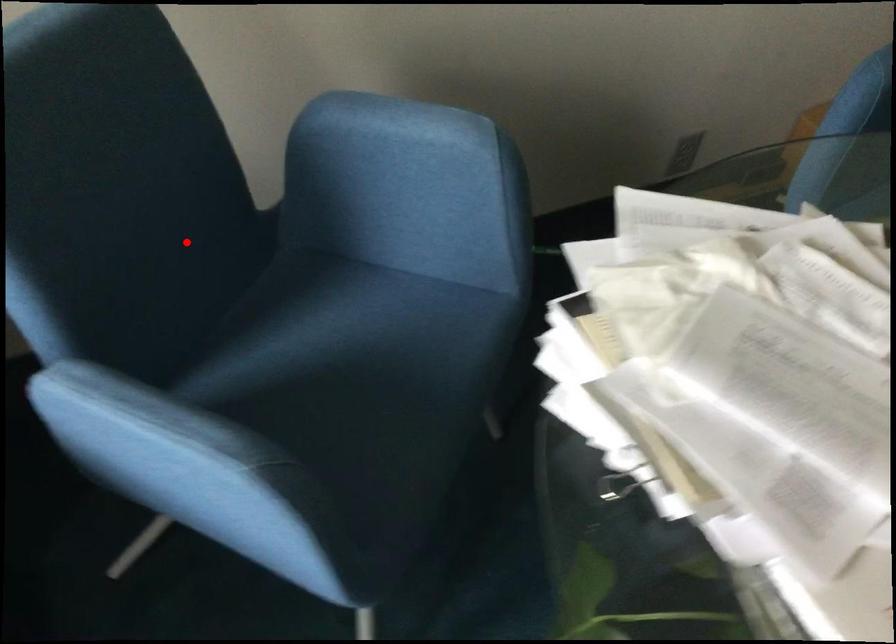
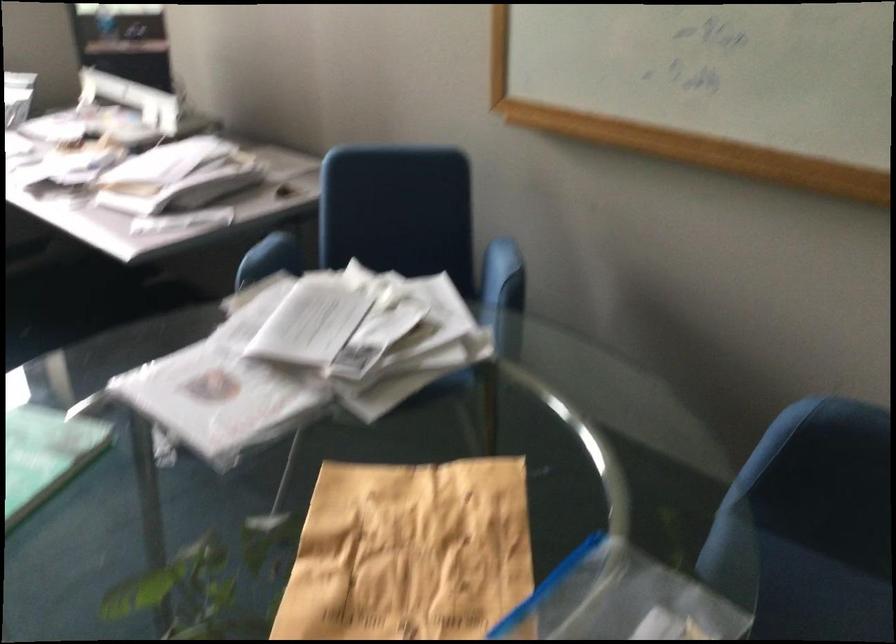
Find the pixel in the second image that matches the highlighted location in the first image.

(395, 268)